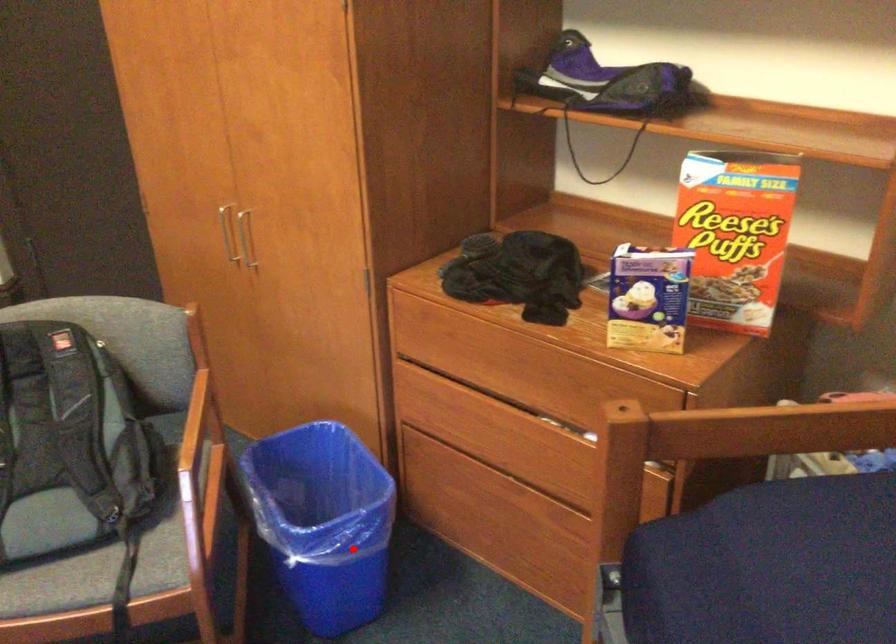
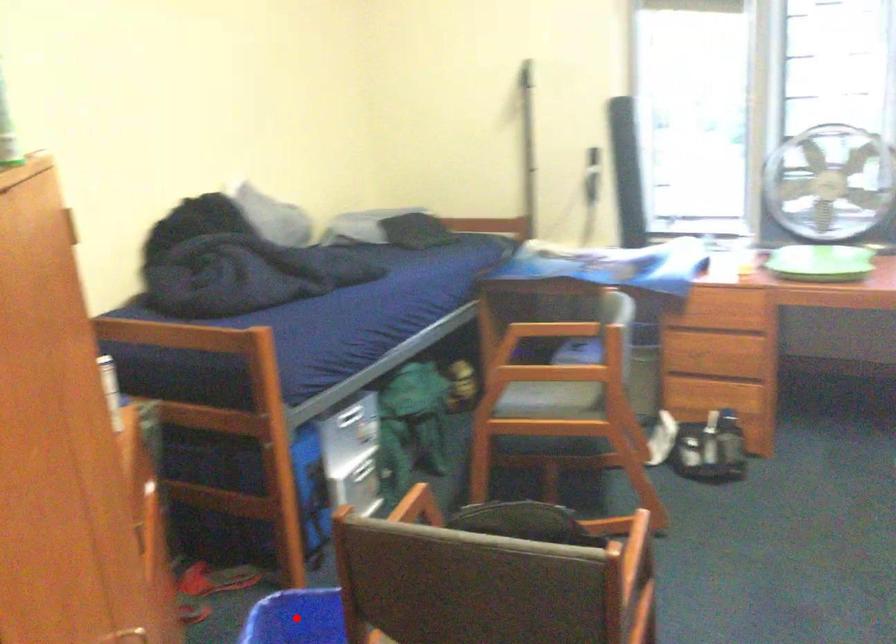
I am providing you with two images of the same scene from different viewpoints. A red point is marked on the first image and another point is marked on the second image. Are the points marked in image1 and image2 representing the same 3D position?

Yes